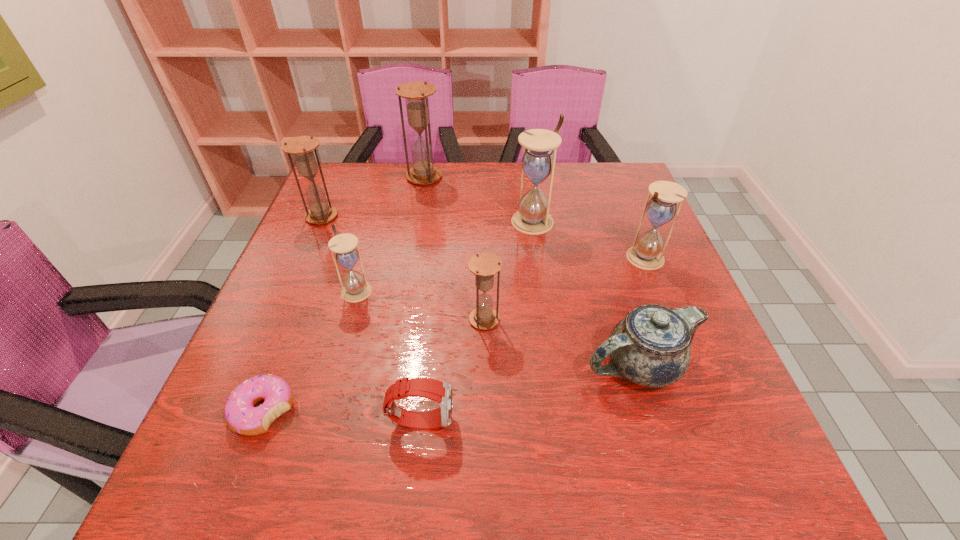
Locate an element on the screen. The width and height of the screenshot is (960, 540). the farthest brown hourglass is located at coordinates (416, 94).

You are a GUI agent. You are given a task and a screenshot of the screen. Output one action in this format:
    pyautogui.click(x=<x>, y=<y>)
    Task: Click on the farthest hourglass
    
    Given the screenshot: What is the action you would take?
    pyautogui.click(x=416, y=94)

Identify the location of the second white hourglass from right to left. The image size is (960, 540). (538, 162).

Where is `the farthest white hourglass`? The height and width of the screenshot is (540, 960). the farthest white hourglass is located at coordinates (538, 162).

At what (x,y) coordinates should I click in order to perform the action: click on the second nearest brown hourglass. Please return your answer as a coordinate pair (x, y). Image resolution: width=960 pixels, height=540 pixels. Looking at the image, I should click on [x=301, y=147].

I want to click on the leftmost brown hourglass, so click(301, 147).

You are a GUI agent. You are given a task and a screenshot of the screen. Output one action in this format:
    pyautogui.click(x=<x>, y=<y>)
    Task: Click on the second biggest white hourglass
    This screenshot has height=540, width=960.
    Given the screenshot: What is the action you would take?
    pyautogui.click(x=645, y=253)

This screenshot has height=540, width=960. What are the coordinates of `the second farthest white hourglass` in the screenshot? It's located at (645, 253).

Locate an element on the screen. This screenshot has width=960, height=540. the fourth object from right to left is located at coordinates (484, 265).

This screenshot has height=540, width=960. What are the coordinates of `the rightmost brown hourglass` in the screenshot? It's located at (484, 265).